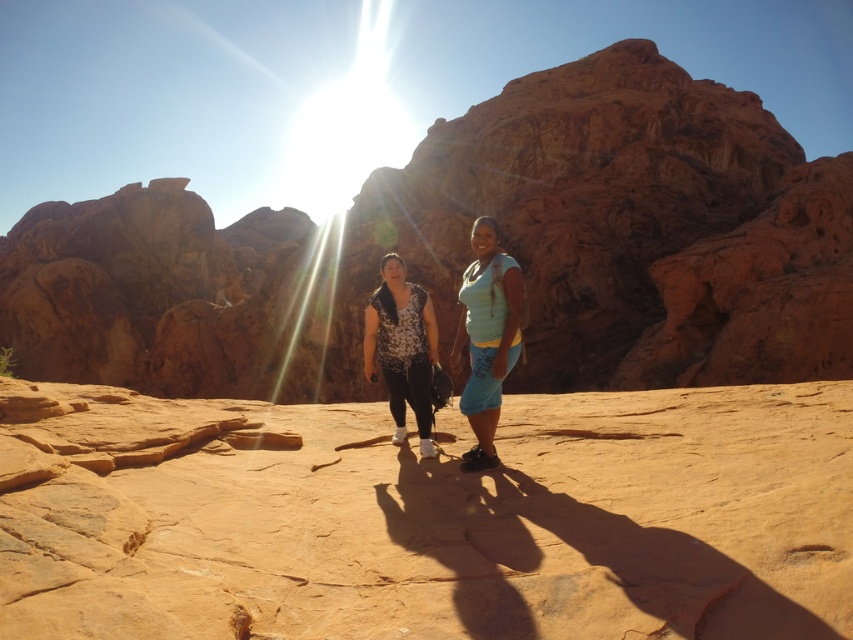
Does rustic sandstone rock formation at center have a larger size compared to matte teal shirt at center?

Yes, rustic sandstone rock formation at center is bigger than matte teal shirt at center.

Can you confirm if rustic sandstone rock formation at center is smaller than matte teal shirt at center?

No, rustic sandstone rock formation at center is not smaller than matte teal shirt at center.

What do you see at coordinates (466, 252) in the screenshot?
I see `rustic sandstone rock formation at center` at bounding box center [466, 252].

Where is `rustic sandstone rock formation at center`? This screenshot has height=640, width=853. rustic sandstone rock formation at center is located at coordinates (466, 252).

Can you confirm if rustic sandstone rock formation at center is positioned to the right of matte floral shirt at center?

Incorrect, rustic sandstone rock formation at center is not on the right side of matte floral shirt at center.

Who is more distant from viewer, (x=717, y=266) or (x=479, y=342)?

The point (x=717, y=266) is behind.

You are a GUI agent. You are given a task and a screenshot of the screen. Output one action in this format:
    pyautogui.click(x=<x>, y=<y>)
    Task: Click on the rustic sandstone rock formation at center
    Image resolution: width=853 pixels, height=640 pixels.
    Given the screenshot: What is the action you would take?
    pyautogui.click(x=466, y=252)

Is point (491, 483) behind point (486, 266)?

No, it is not.

Does smooth sandstone desert at center lie behind matte floral shirt at center?

No.

Does point (329, 580) lie behind point (509, 336)?

That is False.

The height and width of the screenshot is (640, 853). What are the coordinates of `smooth sandstone desert at center` in the screenshot? It's located at (426, 516).